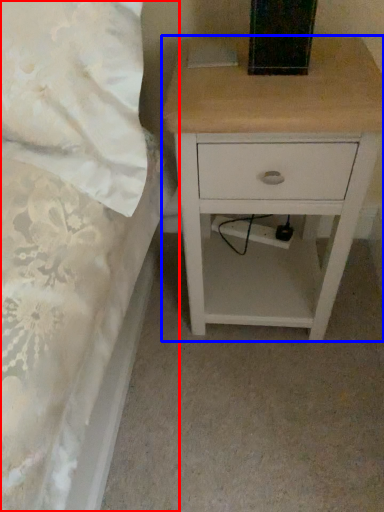
Question: Which point is further to the camera, bed (highlighted by a red box) or nightstand (highlighted by a blue box)?

Choices:
 (A) bed
 (B) nightstand

Answer: (B)